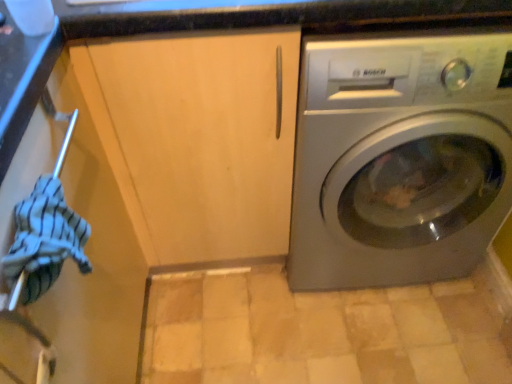
This screenshot has height=384, width=512. Describe the element at coordinates (45, 239) in the screenshot. I see `striped cotton towel at left` at that location.

You are a GUI agent. You are given a task and a screenshot of the screen. Output one action in this format:
    pyautogui.click(x=<x>, y=<y>)
    Task: Click on the satin silver washing machine at right
    This screenshot has height=384, width=512.
    Given the screenshot: What is the action you would take?
    pyautogui.click(x=400, y=159)

This screenshot has width=512, height=384. I want to click on striped cotton towel at left, so click(x=45, y=239).

Is striped cotton towel at left inside matte wood cabinet at center?

Actually, striped cotton towel at left is outside matte wood cabinet at center.

Find the location of `clothing on the left of matte wood cabinet at center`. clothing on the left of matte wood cabinet at center is located at coordinates (45, 239).

Considering the relative sizes of matte wood cabinet at center and striped cotton towel at left in the image provided, is matte wood cabinet at center smaller than striped cotton towel at left?

No, matte wood cabinet at center is not smaller than striped cotton towel at left.

Can you confirm if matte wood cabinet at center is positioned to the right of striped cotton towel at left?

Indeed, matte wood cabinet at center is positioned on the right side of striped cotton towel at left.

Is striped cotton towel at left next to matte wood cabinet at center?

No, striped cotton towel at left is not next to matte wood cabinet at center.

Looking at this image, is striped cotton towel at left surrounding matte wood cabinet at center?

No, striped cotton towel at left does not contain matte wood cabinet at center.

Who is shorter, striped cotton towel at left or matte wood cabinet at center?

Standing shorter between the two is striped cotton towel at left.

Between striped cotton towel at left and matte wood cabinet at center, which one has larger size?

matte wood cabinet at center is bigger.

The width and height of the screenshot is (512, 384). In order to click on washing machine behind the matte wood cabinet at center in this screenshot , I will do `click(400, 159)`.

Is satin silver washing machine at right wider than matte wood cabinet at center?

Yes, satin silver washing machine at right is wider than matte wood cabinet at center.

How distant is satin silver washing machine at right from matte wood cabinet at center?

A distance of 10.09 inches exists between satin silver washing machine at right and matte wood cabinet at center.

Considering the positions of objects striped cotton towel at left and satin silver washing machine at right in the image provided, who is behind, striped cotton towel at left or satin silver washing machine at right?

satin silver washing machine at right is further away from the camera.

The width and height of the screenshot is (512, 384). I want to click on clothing on the left of satin silver washing machine at right, so click(x=45, y=239).

Can you confirm if striped cotton towel at left is wider than satin silver washing machine at right?

No.

Which of these two, striped cotton towel at left or satin silver washing machine at right, is bigger?

satin silver washing machine at right.

Does satin silver washing machine at right have a greater width compared to striped cotton towel at left?

Correct, the width of satin silver washing machine at right exceeds that of striped cotton towel at left.

Is satin silver washing machine at right in contact with striped cotton towel at left?

There is a gap between satin silver washing machine at right and striped cotton towel at left.

Does satin silver washing machine at right have a greater height compared to striped cotton towel at left?

A: Indeed, satin silver washing machine at right has a greater height compared to striped cotton towel at left.

From the image's perspective, relative to striped cotton towel at left, is satin silver washing machine at right above or below?

satin silver washing machine at right is situated higher than striped cotton towel at left in the image.

Can you confirm if matte wood cabinet at center is bigger than satin silver washing machine at right?

No, matte wood cabinet at center is not bigger than satin silver washing machine at right.

In the image, is matte wood cabinet at center positioned in front of or behind satin silver washing machine at right?

matte wood cabinet at center is positioned closer to the viewer than satin silver washing machine at right.

From a real-world perspective, is matte wood cabinet at center above or below satin silver washing machine at right?

Clearly, from a real-world perspective, matte wood cabinet at center is above satin silver washing machine at right.

Who is shorter, matte wood cabinet at center or satin silver washing machine at right?

Standing shorter between the two is satin silver washing machine at right.

At what (x,y) coordinates should I click in order to perform the action: click on cabinetry that is under the striped cotton towel at left (from a real-world perspective). Please return your answer as a coordinate pair (x, y). This screenshot has height=384, width=512. Looking at the image, I should click on (198, 139).

You are a GUI agent. You are given a task and a screenshot of the screen. Output one action in this format:
    pyautogui.click(x=<x>, y=<y>)
    Task: Click on the clothing located below the matte wood cabinet at center (from the image's perspective)
    This screenshot has height=384, width=512.
    Given the screenshot: What is the action you would take?
    pyautogui.click(x=45, y=239)

Based on their spatial positions, is striped cotton towel at left or satin silver washing machine at right closer to matte wood cabinet at center?

satin silver washing machine at right lies closer to matte wood cabinet at center than the other object.

Looking at the image, which one is located closer to satin silver washing machine at right, striped cotton towel at left or matte wood cabinet at center?

Among the two, matte wood cabinet at center is located nearer to satin silver washing machine at right.

Considering their positions, is satin silver washing machine at right positioned closer to striped cotton towel at left than matte wood cabinet at center?

matte wood cabinet at center lies closer to striped cotton towel at left than the other object.

When comparing their distances from matte wood cabinet at center, does satin silver washing machine at right or striped cotton towel at left seem closer?

The object closer to matte wood cabinet at center is satin silver washing machine at right.

Considering their positions, is matte wood cabinet at center positioned further to striped cotton towel at left than satin silver washing machine at right?

satin silver washing machine at right is further to striped cotton towel at left.

When comparing their distances from satin silver washing machine at right, does matte wood cabinet at center or striped cotton towel at left seem further?

striped cotton towel at left is further to satin silver washing machine at right.

The height and width of the screenshot is (384, 512). Identify the location of cabinetry located between striped cotton towel at left and satin silver washing machine at right in the left-right direction. (198, 139).